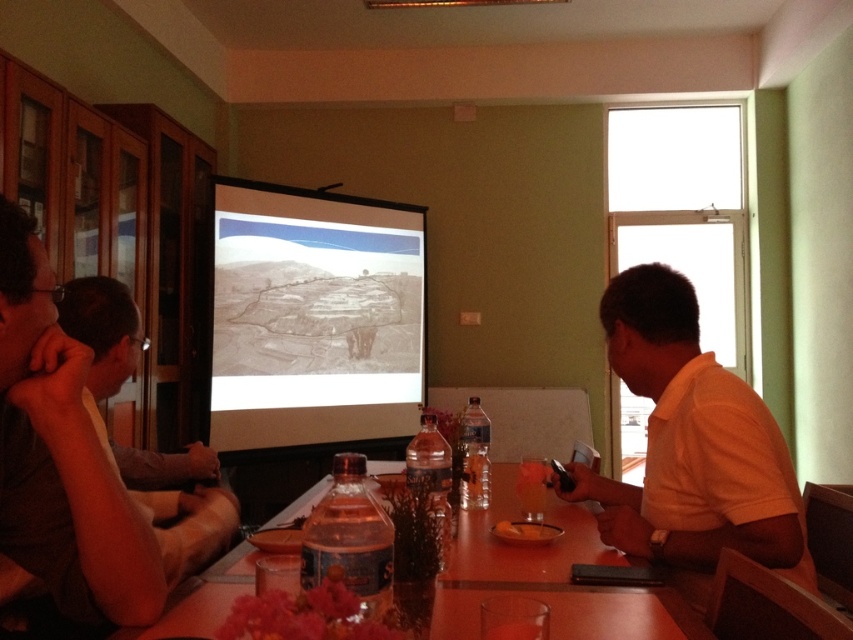
Question: Which of the following is the farthest from the observer?

Choices:
 (A) (94, 282)
 (B) (601, 620)
 (C) (109, 561)
 (D) (641, 269)

Answer: (D)

Question: Does matte gray projector screen at center lie behind dark brown hair at left?

Choices:
 (A) no
 (B) yes

Answer: (B)

Question: Where is matte gray projector screen at center located in relation to yellow matte bowl at center in the image?

Choices:
 (A) below
 (B) above

Answer: (B)

Question: Estimate the real-world distances between objects in this image. Which object is farther from the matte gray shirt at left?

Choices:
 (A) dark brown hair at left
 (B) yellow matte bowl at center
 (C) wooden table at center
 (D) white matte shirt at right

Answer: (D)

Question: Considering the real-world distances, which object is closest to the wooden table at center?

Choices:
 (A) dark brown hair at left
 (B) matte gray projector screen at center

Answer: (A)

Question: Can you confirm if matte gray projector screen at center is positioned to the right of dark brown hair at left?

Choices:
 (A) yes
 (B) no

Answer: (B)